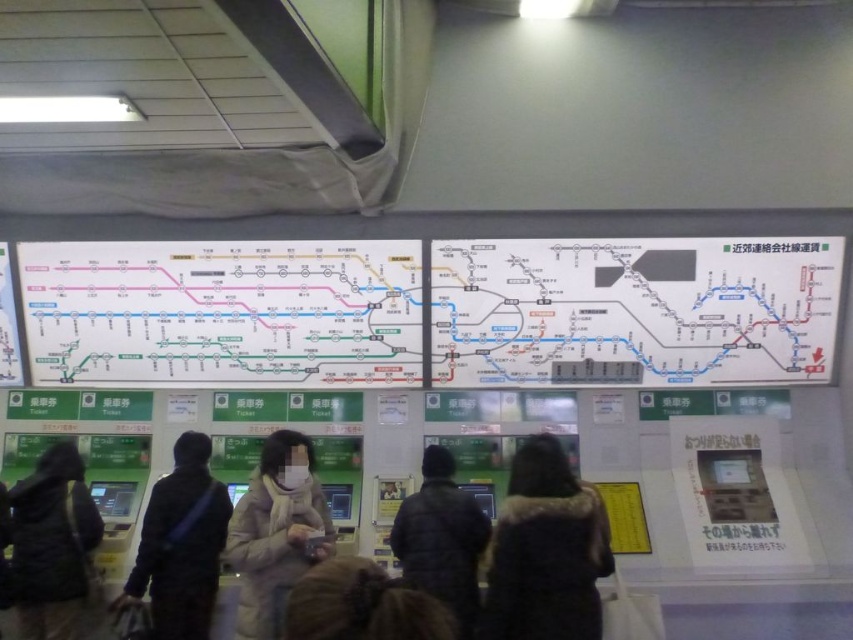
You are standing in the train station ticketing area and see a white puffy coat at center and a black puffy coat at center. Which coat is positioned to the left?

The white puffy coat at center is to the left of the black puffy coat at center, so the white puffy coat at center is positioned to the left.

You are a traveler standing in the train station ticketing area and want to check the map to plan your route. However, your view is partially blocked by a dark gray jacket at center. Based on the scene description, can you still see the white paper map at center clearly?

The white paper map at center is positioned on the right side of dark gray jacket at center, so you can see the white paper map at center by looking to the right of the dark gray jacket at center.

You are a janitor in the train station and need to clean the floor around the white puffy coat at center and the black puffy coat at center. Which coat will require you to move less to clean around it?

The white puffy coat at center occupies less space than the black puffy coat at center, so you will need to move less to clean around the white puffy coat at center.